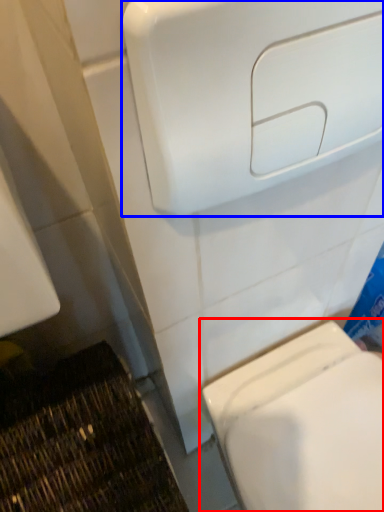
Question: Which of the following is the closest to the observer, toilet (highlighted by a red box) or hand dryer (highlighted by a blue box)?

Choices:
 (A) toilet
 (B) hand dryer

Answer: (B)